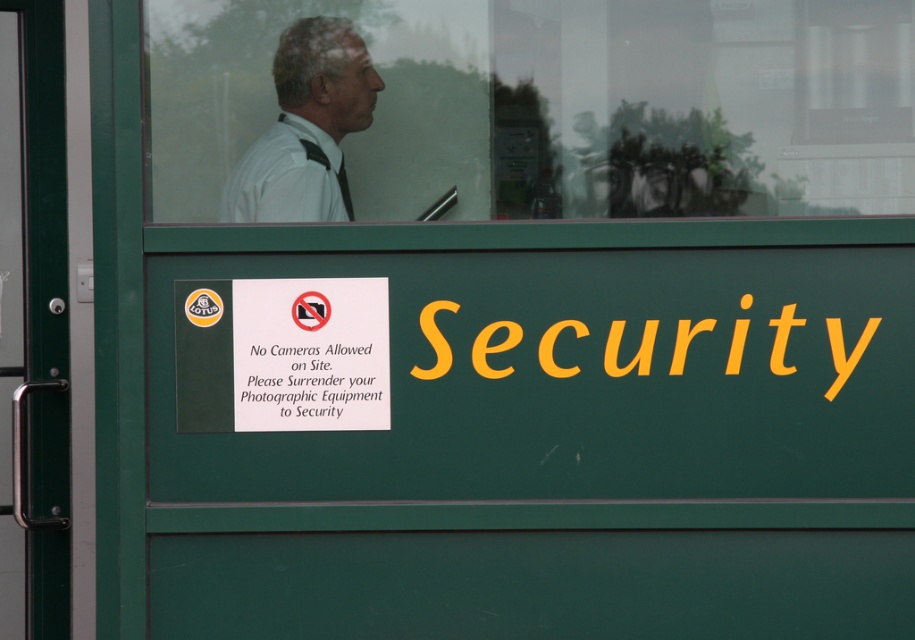
You are a visitor at the security checkpoint. You need to hand over your camera to the security officer behind the yellow matte security at center. Can you reach him through the transparent glass window at upper center?

The transparent glass window at upper center is wider than the yellow matte security at center, so you can reach him through the transparent glass window at upper center as it spans a greater width.

You are an attendee at the event and you see the transparent glass window at upper center and the white shirt at upper center. Which object is positioned to the right side?

The transparent glass window at upper center is positioned to the right of the white shirt at upper center.